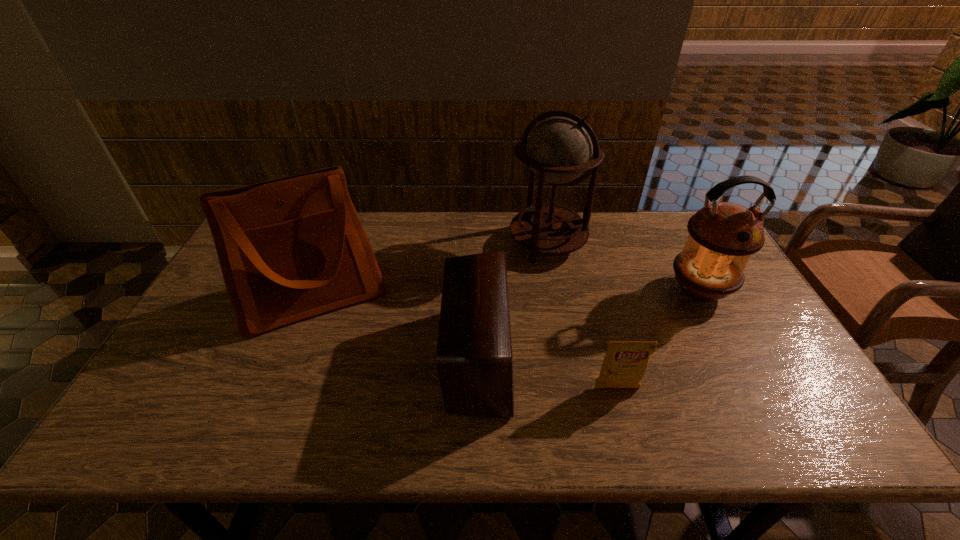
The image size is (960, 540). Identify the location of free region located 0.090m on the front of the crisp (potato chip) with the logo. (628, 430).

Find the location of a particular element. object present at the far edge is located at coordinates (559, 149).

Find the location of a particular element. object that is at the near edge is located at coordinates (474, 361).

Where is `object situated at the left edge`? object situated at the left edge is located at coordinates tap(291, 248).

Locate an element on the screen. The image size is (960, 540). object that is at the right edge is located at coordinates (723, 236).

Locate an element on the screen. The width and height of the screenshot is (960, 540). vacant space at the far edge of the desktop is located at coordinates (484, 226).

This screenshot has width=960, height=540. In the image, there is a desktop. Find the location of `free region at the near edge`. free region at the near edge is located at coordinates (275, 423).

Find the location of a particular element. The height and width of the screenshot is (540, 960). free location at the left edge is located at coordinates (197, 356).

Locate an element on the screen. The image size is (960, 540). free space at the right edge of the desktop is located at coordinates (709, 305).

What are the coordinates of `vacant space at the near left corner` in the screenshot? It's located at (163, 414).